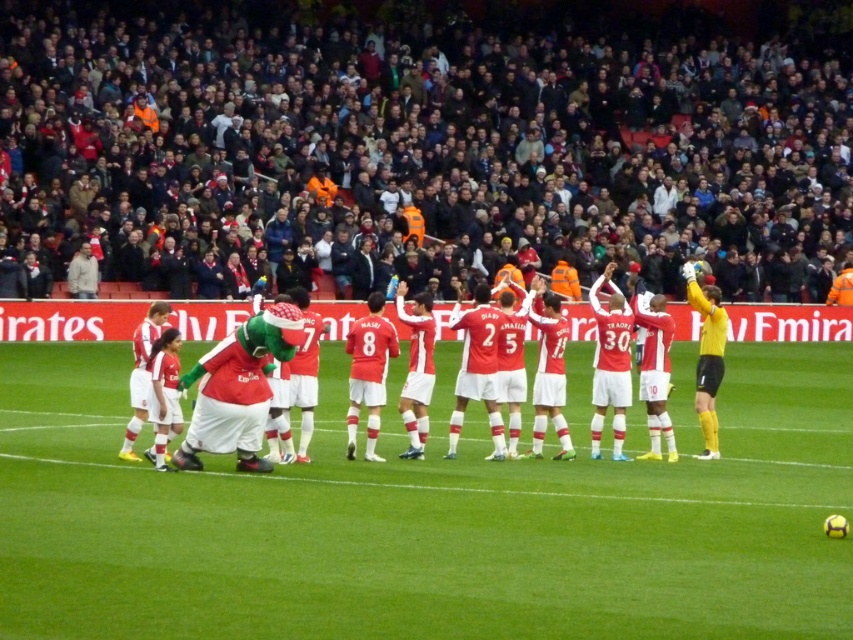
Question: Which of the following is the closest to the observer?

Choices:
 (A) matte red jersey at center
 (B) green grass football field at center

Answer: (B)

Question: From the image, what is the correct spatial relationship of dark gray concrete stadium at upper center in relation to green grass football field at center?

Choices:
 (A) left
 (B) right

Answer: (B)

Question: Is dark gray concrete stadium at upper center to the left of matte red jersey at center from the viewer's perspective?

Choices:
 (A) yes
 (B) no

Answer: (B)

Question: Which point appears closest to the camera in this image?

Choices:
 (A) (466, 465)
 (B) (592, 61)
 (C) (466, 356)

Answer: (A)

Question: Which of the following is the closest to the observer?

Choices:
 (A) (817, 540)
 (B) (669, 333)
 (C) (790, 257)

Answer: (A)

Question: Does dark gray concrete stadium at upper center have a smaller size compared to matte red jersey at center?

Choices:
 (A) no
 (B) yes

Answer: (A)